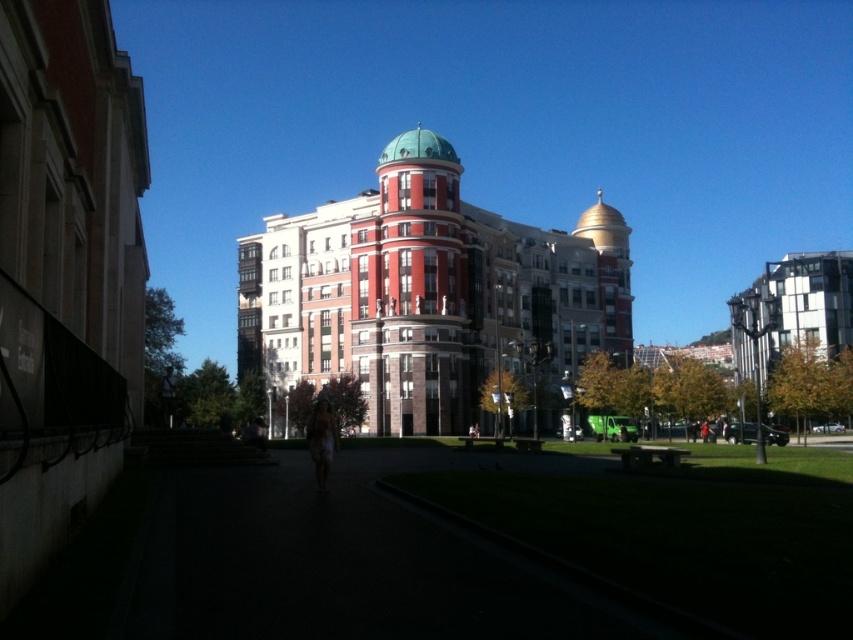
Between green dome at center and teal dome at center, which one appears on the left side from the viewer's perspective?

From the viewer's perspective, teal dome at center appears more on the left side.

Does green dome at center appear over teal dome at center?

Actually, green dome at center is below teal dome at center.

What do you see at coordinates (428, 298) in the screenshot?
I see `green dome at center` at bounding box center [428, 298].

The width and height of the screenshot is (853, 640). I want to click on green dome at center, so tap(428, 298).